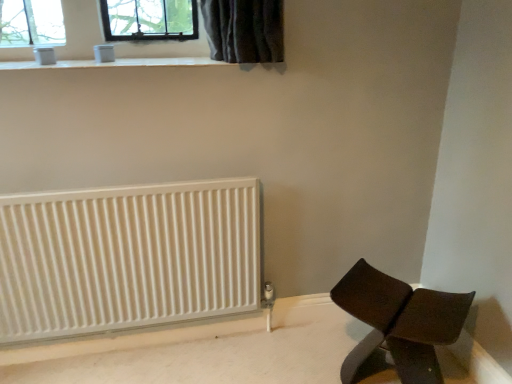
Question: Can you confirm if brown leather chair at lower right is positioned to the right of white ribbed radiator at lower left?

Choices:
 (A) yes
 (B) no

Answer: (A)

Question: Is brown leather chair at lower right directly adjacent to white ribbed radiator at lower left?

Choices:
 (A) yes
 (B) no

Answer: (B)

Question: Is brown leather chair at lower right shorter than white ribbed radiator at lower left?

Choices:
 (A) yes
 (B) no

Answer: (A)

Question: From a real-world perspective, does brown leather chair at lower right stand above white ribbed radiator at lower left?

Choices:
 (A) no
 (B) yes

Answer: (A)

Question: Is brown leather chair at lower right facing towards white ribbed radiator at lower left?

Choices:
 (A) yes
 (B) no

Answer: (B)

Question: Based on their sizes in the image, would you say white ribbed radiator at lower left is bigger or smaller than brown leather chair at lower right?

Choices:
 (A) big
 (B) small

Answer: (B)

Question: From a real-world perspective, is white ribbed radiator at lower left positioned above or below brown leather chair at lower right?

Choices:
 (A) below
 (B) above

Answer: (B)

Question: From the image's perspective, is white ribbed radiator at lower left located above or below brown leather chair at lower right?

Choices:
 (A) below
 (B) above

Answer: (B)

Question: Is point (237, 248) positioned closer to the camera than point (415, 329)?

Choices:
 (A) closer
 (B) farther

Answer: (B)

Question: Is white smooth window sill at upper center in front of or behind brown leather chair at lower right in the image?

Choices:
 (A) front
 (B) behind

Answer: (B)

Question: Is white smooth window sill at upper center situated inside brown leather chair at lower right or outside?

Choices:
 (A) outside
 (B) inside

Answer: (A)

Question: Is white smooth window sill at upper center to the left or to the right of brown leather chair at lower right in the image?

Choices:
 (A) left
 (B) right

Answer: (A)

Question: From the image's perspective, relative to brown leather chair at lower right, is white smooth window sill at upper center above or below?

Choices:
 (A) above
 (B) below

Answer: (A)

Question: Relative to white ribbed radiator at lower left, is brown leather chair at lower right in front or behind?

Choices:
 (A) front
 (B) behind

Answer: (A)

Question: Is point (455, 304) closer or farther from the camera than point (247, 251)?

Choices:
 (A) farther
 (B) closer

Answer: (B)